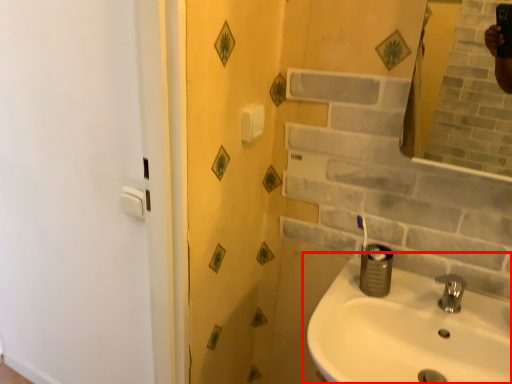
Question: From the image's perspective, what is the correct spatial positioning of sink (annotated by the red box) in reference to tap?

Choices:
 (A) above
 (B) below

Answer: (B)